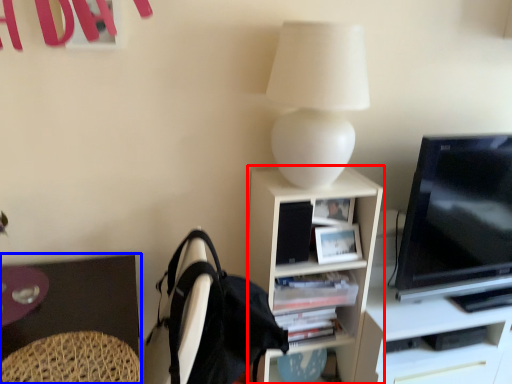
Question: Which of the following is the farthest to the observer, shelf (highlighted by a red box) or desk (highlighted by a blue box)?

Choices:
 (A) shelf
 (B) desk

Answer: (A)